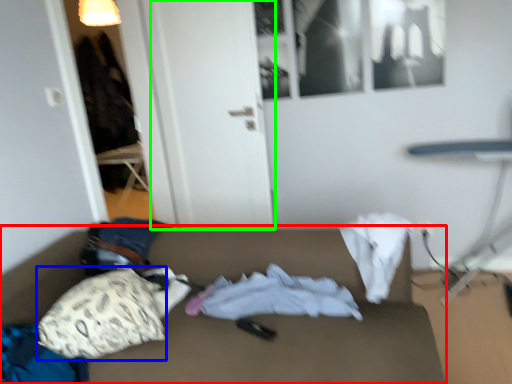
Question: Based on their relative distances, which object is nearer to studio couch (highlighted by a red box)? Choose from throw pillow (highlighted by a blue box) and door (highlighted by a green box).

Choices:
 (A) throw pillow
 (B) door

Answer: (A)